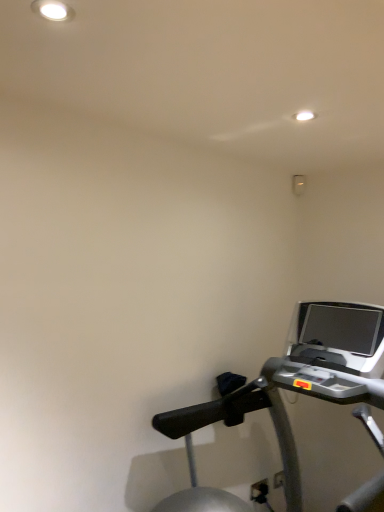
What do you see at coordinates (290, 390) in the screenshot? I see `silver metallic stationary bicycle at right` at bounding box center [290, 390].

Measure the distance between point (240, 420) and camera.

Point (240, 420) is 7.37 feet from camera.

Image resolution: width=384 pixels, height=512 pixels. I want to click on silver metallic stationary bicycle at right, so click(290, 390).

In order to click on silver metallic stationary bicycle at right in this screenshot , I will do `click(290, 390)`.